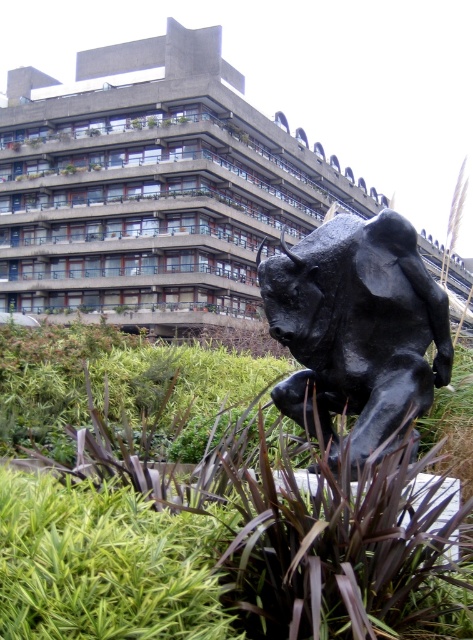
Who is positioned more to the right, concrete building at center or black polished bull at center?

concrete building at center

Is concrete building at center below black polished bull at center?

Incorrect, concrete building at center is not positioned below black polished bull at center.

The height and width of the screenshot is (640, 473). Find the location of `concrete building at center`. concrete building at center is located at coordinates pos(155,189).